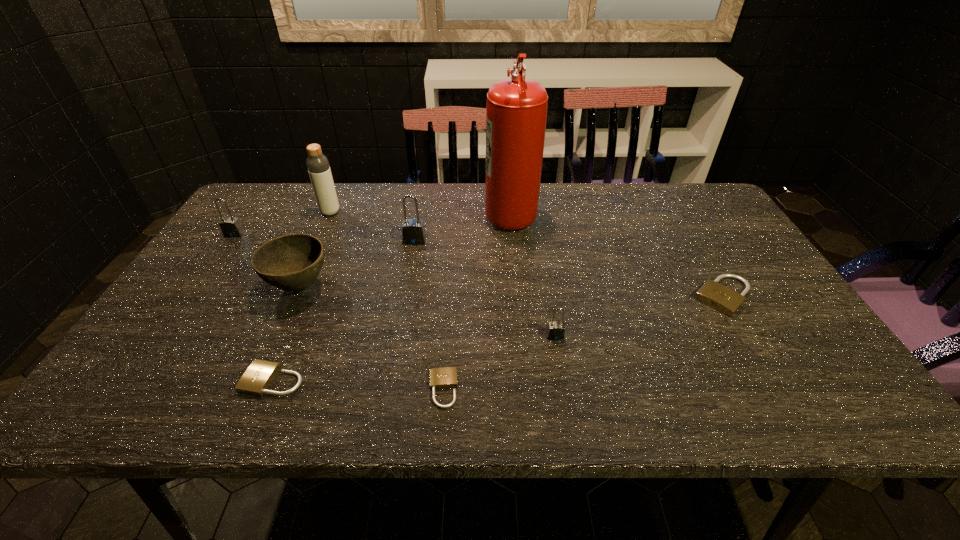
Where is `red fire extinguisher`? red fire extinguisher is located at coordinates (516, 111).

Identify the location of the tallest object. This screenshot has height=540, width=960. (516, 111).

Where is `the eighth shortest object`? the eighth shortest object is located at coordinates (317, 163).

This screenshot has width=960, height=540. In order to click on gray bottle in this screenshot , I will do `click(317, 163)`.

You are a GUI agent. You are given a task and a screenshot of the screen. Output one action in this format:
    pyautogui.click(x=<x>, y=<y>)
    Task: Click on the tallest padlock
    This screenshot has width=960, height=540.
    Given the screenshot: What is the action you would take?
    pyautogui.click(x=413, y=230)

What are the coordinates of `the third padlock from left to right` in the screenshot? It's located at tap(413, 230).

I want to click on the leftmost object, so click(230, 226).

Locate an element on the screen. This screenshot has height=540, width=960. the leftmost padlock is located at coordinates (230, 226).

Locate an element on the screen. brown bowl is located at coordinates (292, 262).

Locate an element on the screen. The image size is (960, 540). the third nearest object is located at coordinates (555, 330).